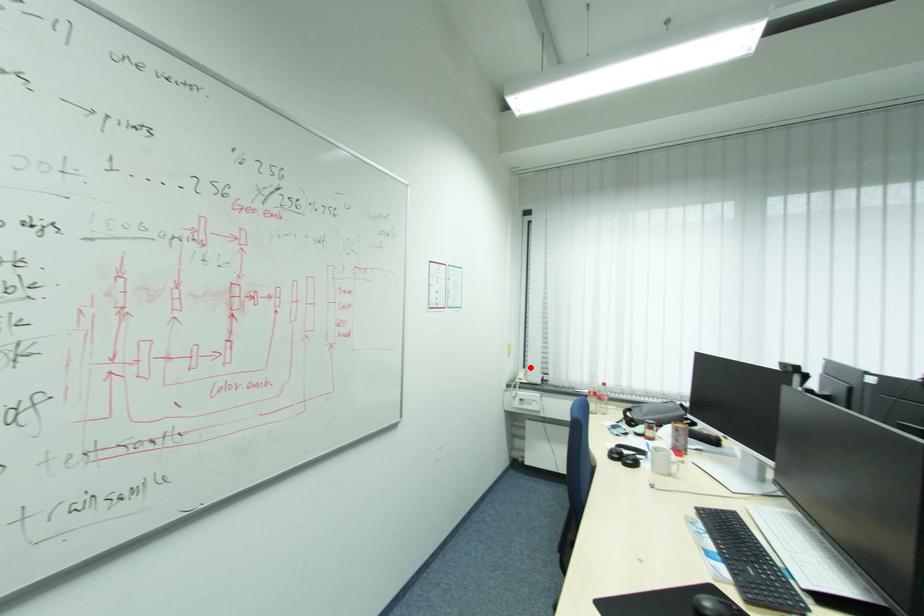
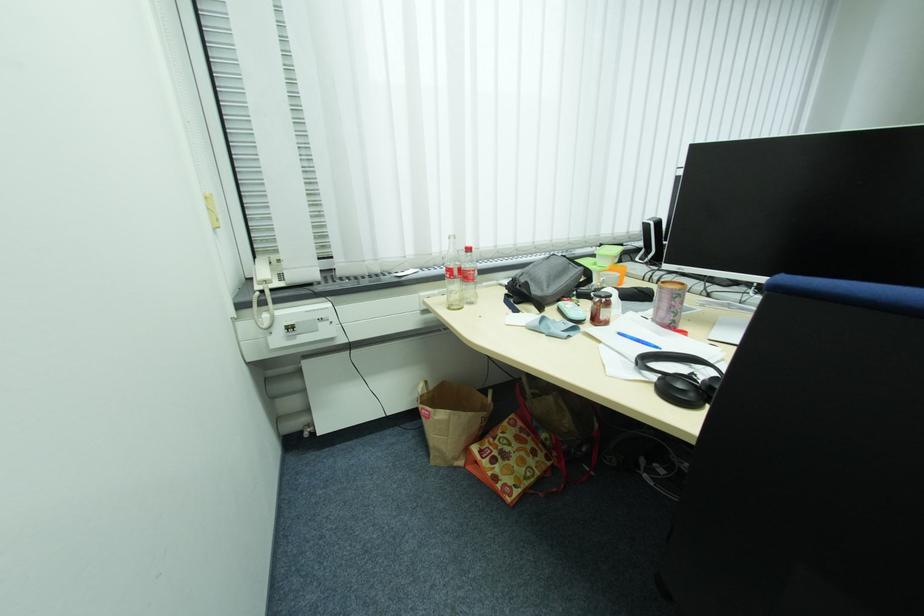
Locate, in the second image, the point that corresponds to the highlighted location in the first image.

(261, 256)